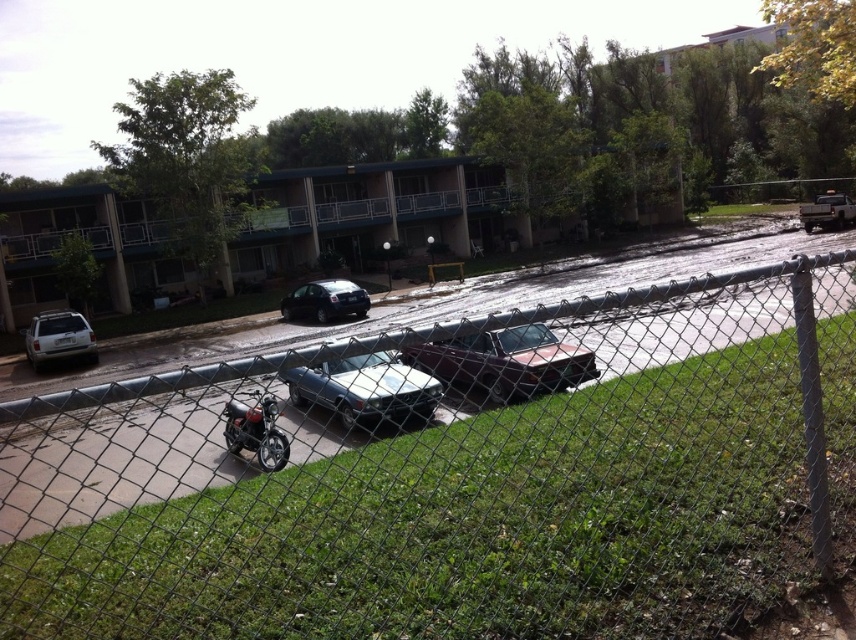
You are standing at the point closest to the viewer in the image. Which point are you at, point (233, 406) or point (84, 332)?

You are at point (233, 406) because it is closer to the viewer than point (84, 332).